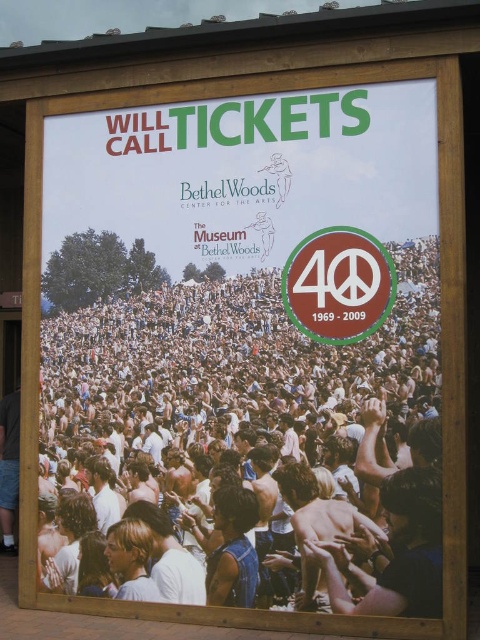
Question: Which of the following is the closest to the observer?

Choices:
 (A) (158, 531)
 (B) (338, 337)

Answer: (B)

Question: Estimate the real-world distances between objects in this image. Which object is closer to the white cotton crowd at center?

Choices:
 (A) matte brown peace sign at center
 (B) matte white signboard at center

Answer: (A)

Question: Is matte white signboard at center in front of matte brown peace sign at center?

Choices:
 (A) yes
 (B) no

Answer: (A)

Question: Is white cotton crowd at center wider than matte brown peace sign at center?

Choices:
 (A) no
 (B) yes

Answer: (B)

Question: Is white cotton crowd at center above matte brown peace sign at center?

Choices:
 (A) yes
 (B) no

Answer: (B)

Question: Estimate the real-world distances between objects in this image. Which object is closer to the white cotton crowd at center?

Choices:
 (A) matte white signboard at center
 (B) matte brown peace sign at center

Answer: (B)